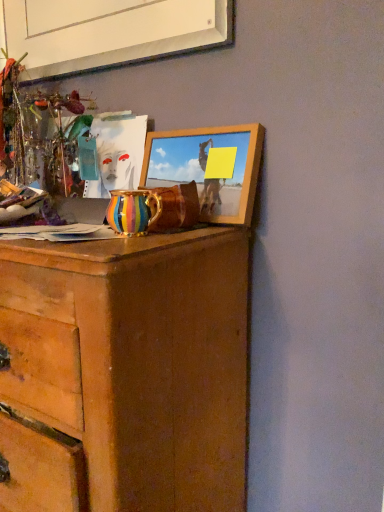
Question: Is multicolored ceramic vase at center to the left of wooden chest of drawers at center from the viewer's perspective?

Choices:
 (A) yes
 (B) no

Answer: (B)

Question: From a real-world perspective, is multicolored ceramic vase at center positioned under wooden chest of drawers at center based on gravity?

Choices:
 (A) yes
 (B) no

Answer: (B)

Question: Does multicolored ceramic vase at center have a lesser width compared to wooden chest of drawers at center?

Choices:
 (A) no
 (B) yes

Answer: (B)

Question: Is multicolored ceramic vase at center far from wooden chest of drawers at center?

Choices:
 (A) yes
 (B) no

Answer: (B)

Question: Is multicolored ceramic vase at center positioned in front of wooden chest of drawers at center?

Choices:
 (A) yes
 (B) no

Answer: (B)

Question: Is multicolored ceramic vase at center behind wooden chest of drawers at center?

Choices:
 (A) yes
 (B) no

Answer: (A)

Question: Can you confirm if wooden picture frame at upper center, which is counted as the second picture frame, starting from the top, is bigger than wooden chest of drawers at center?

Choices:
 (A) yes
 (B) no

Answer: (B)

Question: From the image's perspective, does wooden picture frame at upper center, arranged as the 1th picture frame when ordered from the bottom, appear lower than wooden chest of drawers at center?

Choices:
 (A) yes
 (B) no

Answer: (B)

Question: Is wooden picture frame at upper center, which is counted as the second picture frame, starting from the top, oriented away from wooden chest of drawers at center?

Choices:
 (A) no
 (B) yes

Answer: (A)

Question: Is wooden picture frame at upper center, which is counted as the second picture frame, starting from the top, positioned in front of wooden chest of drawers at center?

Choices:
 (A) yes
 (B) no

Answer: (B)

Question: Can you confirm if wooden picture frame at upper center, arranged as the 1th picture frame when ordered from the bottom, is shorter than wooden chest of drawers at center?

Choices:
 (A) yes
 (B) no

Answer: (A)

Question: Is wooden chest of drawers at center inside wooden picture frame at upper center, arranged as the 1th picture frame when ordered from the bottom?

Choices:
 (A) no
 (B) yes

Answer: (A)

Question: From a real-world perspective, is wooden picture frame at upper center, which is counted as the second picture frame, starting from the top, located beneath white matte picture frame at upper center, the 1th picture frame from the top?

Choices:
 (A) no
 (B) yes

Answer: (B)